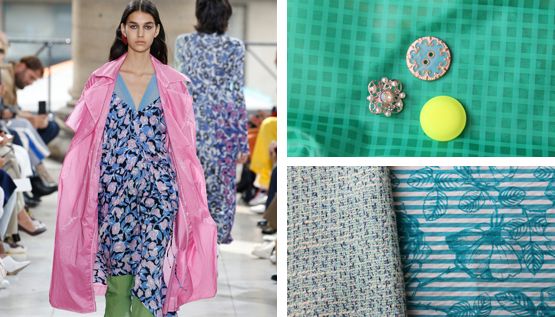
The height and width of the screenshot is (317, 555). Identify the location of wall. (100, 30).